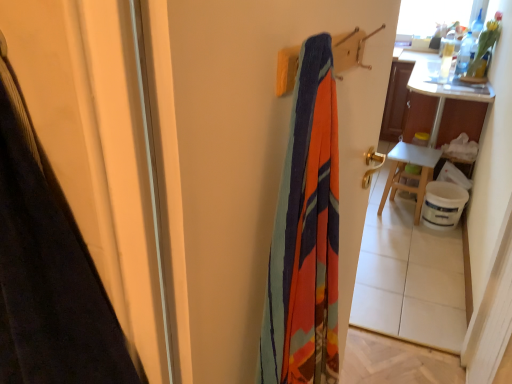
Question: From the image's perspective, is white wooden table at right on textured fabric screen door at center?

Choices:
 (A) no
 (B) yes

Answer: (B)

Question: From the image's perspective, is white wooden table at right beneath textured fabric screen door at center?

Choices:
 (A) no
 (B) yes

Answer: (A)

Question: Considering the relative sizes of white wooden table at right and textured fabric screen door at center in the image provided, is white wooden table at right shorter than textured fabric screen door at center?

Choices:
 (A) no
 (B) yes

Answer: (B)

Question: Can you confirm if white wooden table at right is bigger than textured fabric screen door at center?

Choices:
 (A) no
 (B) yes

Answer: (A)

Question: From a real-world perspective, is white wooden table at right positioned over textured fabric screen door at center based on gravity?

Choices:
 (A) no
 (B) yes

Answer: (A)

Question: Is point (205, 241) positioned closer to the camera than point (433, 117)?

Choices:
 (A) farther
 (B) closer

Answer: (B)

Question: Looking at their shapes, would you say textured fabric screen door at center is wider or thinner than white wooden table at right?

Choices:
 (A) wide
 (B) thin

Answer: (B)

Question: From a real-world perspective, is textured fabric screen door at center above or below white wooden table at right?

Choices:
 (A) below
 (B) above

Answer: (B)

Question: Choose the correct answer: Is textured fabric screen door at center inside white wooden table at right or outside it?

Choices:
 (A) inside
 (B) outside

Answer: (B)

Question: From a real-world perspective, is white wooden table at right above or below white wooden table at right?

Choices:
 (A) above
 (B) below

Answer: (B)

Question: In the image, is white wooden table at right positioned in front of or behind white wooden table at right?

Choices:
 (A) front
 (B) behind

Answer: (B)

Question: Considering the positions of white wooden table at right and white wooden table at right in the image, is white wooden table at right wider or thinner than white wooden table at right?

Choices:
 (A) wide
 (B) thin

Answer: (B)

Question: Would you say white wooden table at right is to the left or to the right of white wooden table at right in the picture?

Choices:
 (A) right
 (B) left

Answer: (B)

Question: Does point (345, 230) appear closer or farther from the camera than point (399, 175)?

Choices:
 (A) closer
 (B) farther

Answer: (A)

Question: Considering the positions of textured fabric screen door at center and white wooden table at right in the image, is textured fabric screen door at center taller or shorter than white wooden table at right?

Choices:
 (A) tall
 (B) short

Answer: (A)